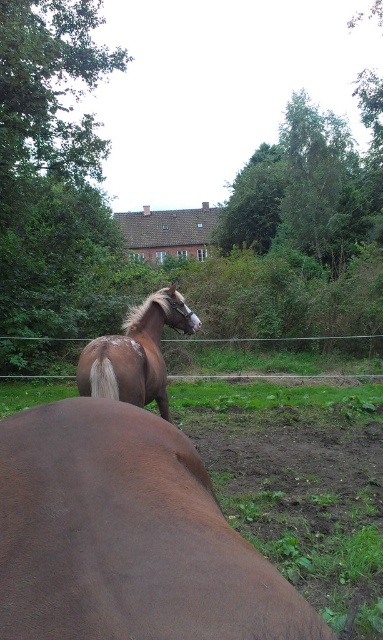
Does green leafy tree at upper left appear on the right side of brown glossy horse at center?

Incorrect, green leafy tree at upper left is not on the right side of brown glossy horse at center.

Is point (13, 342) positioned before point (152, 369)?

That is False.

Who is more forward, [31,312] or [165,401]?

Point [165,401] is in front.

Find the location of a particular element. The width and height of the screenshot is (383, 640). green leafy tree at upper left is located at coordinates (50, 164).

Does brown matte horse at center have a lesser height compared to green leafy tree at upper left?

Yes, brown matte horse at center is shorter than green leafy tree at upper left.

Can you confirm if brown matte horse at center is smaller than green leafy tree at upper left?

Yes.

Find the location of `brown matte horse at center`. brown matte horse at center is located at coordinates (126, 536).

Looking at this image, can you confirm if brown matte horse at center is wider than brown glossy horse at center?

No.

Can you confirm if brown matte horse at center is shorter than brown glossy horse at center?

Yes.

Is point (232, 548) farther from camera compared to point (147, 324)?

No, (232, 548) is closer to viewer.

I want to click on brown matte horse at center, so click(x=126, y=536).